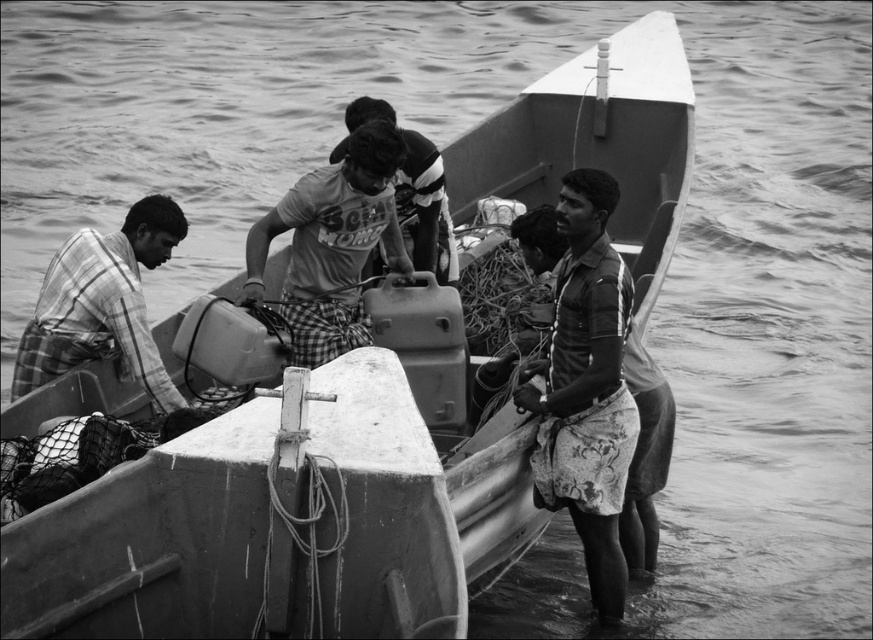
You are standing on the dock observing the two fishermen wearing checkered fabric shirts. Which fisherman is closer to you, the one wearing the checkered fabric shirt at center or the one wearing the checkered fabric shirt at left?

The checkered fabric shirt at center is in front of the checkered fabric shirt at left, so the fisherman wearing the checkered fabric shirt at center is closer to you.

From the picture: You are standing on the wooden boat and want to hand a fishing net to someone. The checkered fabric shirt at center and the matte gray shirt at center are both on the boat. Which shirt is closer to you?

The checkered fabric shirt at center is 3.50 meters away from the matte gray shirt at center. Since you are on the boat, the distance between them is 3.50 meters, but without knowing your exact position, it is impossible to determine which is closer to you.